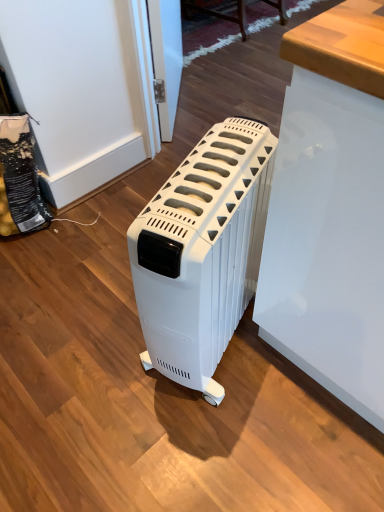
Where is `vacant space situated above white plastic radiator at center (from a real-world perspective)`? This screenshot has height=512, width=384. vacant space situated above white plastic radiator at center (from a real-world perspective) is located at coordinates (210, 176).